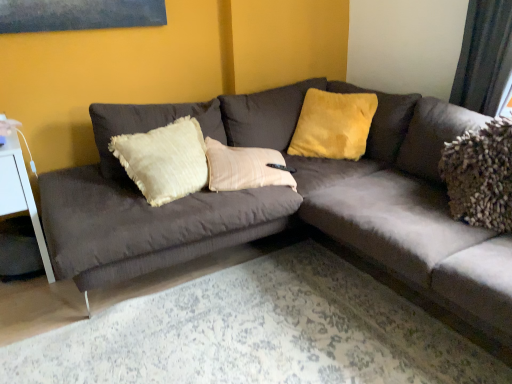
Question: From the image's perspective, is velvet yellow pillow at upper center located above or below white glossy side table at left?

Choices:
 (A) above
 (B) below

Answer: (A)

Question: In terms of size, does velvet yellow pillow at upper center appear bigger or smaller than white glossy side table at left?

Choices:
 (A) big
 (B) small

Answer: (B)

Question: Which of these objects is positioned farthest from the white glossy side table at left?

Choices:
 (A) suede-like dark gray couch at center
 (B) velvet yellow pillow at upper center

Answer: (B)

Question: Considering the real-world distances, which object is farthest from the white glossy side table at left?

Choices:
 (A) suede-like dark gray couch at center
 (B) velvet yellow pillow at upper center

Answer: (B)